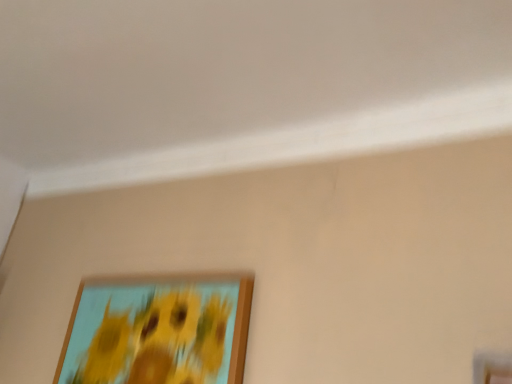
Identify the location of wooden picture frame at lower left. This screenshot has width=512, height=384. (158, 330).

What do you see at coordinates (158, 330) in the screenshot?
I see `wooden picture frame at lower left` at bounding box center [158, 330].

The width and height of the screenshot is (512, 384). I want to click on wooden picture frame at lower left, so click(158, 330).